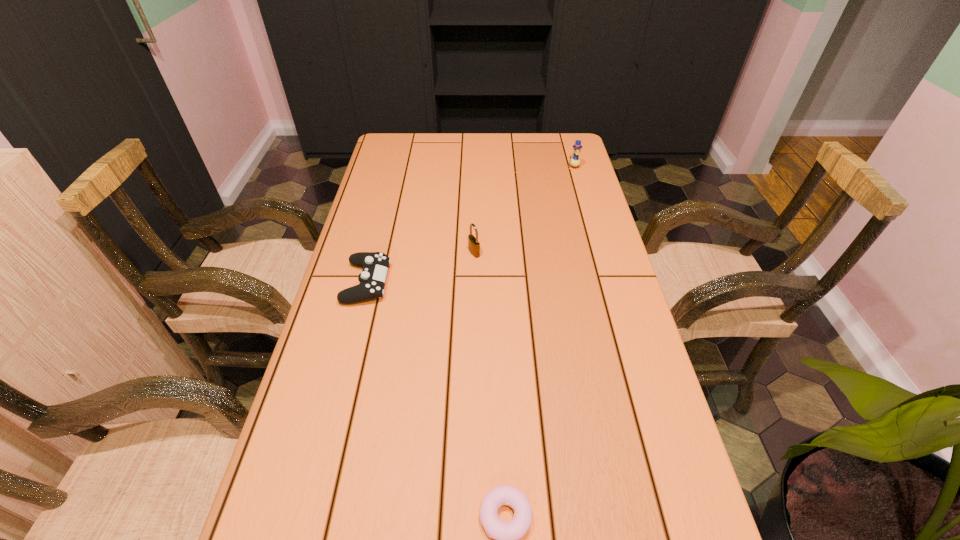
The height and width of the screenshot is (540, 960). I want to click on the farthest object, so click(575, 161).

Identify the location of the rightmost object. The image size is (960, 540). (575, 161).

Identify the location of the third nearest object. The height and width of the screenshot is (540, 960). (473, 244).

Find the location of a particular element. This screenshot has width=960, height=540. the leftmost object is located at coordinates (375, 265).

Locate an element on the screen. The width and height of the screenshot is (960, 540). control is located at coordinates (375, 265).

The image size is (960, 540). I want to click on free space located on the face of the rightmost object, where the monocle is placed, so click(582, 197).

The height and width of the screenshot is (540, 960). I want to click on vacant space located 0.360m on the front of the second farthest object, so click(x=472, y=367).

Locate an element on the screen. The image size is (960, 540). vacant point located 0.170m on the surface of the leftmost object is located at coordinates (453, 282).

This screenshot has height=540, width=960. Identify the location of object that is at the far edge. (575, 161).

I want to click on object located in the left edge section of the desktop, so click(375, 265).